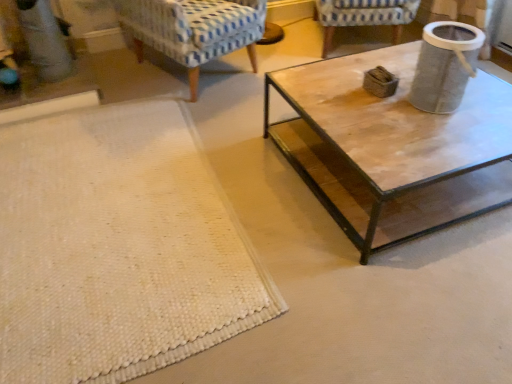
Question: From the image's perspective, is textured gray trash can at upper right under blue patterned fabric chair at upper left, which is the 2th chair from right to left?

Choices:
 (A) no
 (B) yes

Answer: (B)

Question: Can you confirm if textured gray trash can at upper right is positioned to the left of blue patterned fabric chair at upper left, which appears as the first chair when viewed from the left?

Choices:
 (A) yes
 (B) no

Answer: (B)

Question: Can blue patterned fabric chair at upper left, which is the 2th chair from right to left, be found inside textured gray trash can at upper right?

Choices:
 (A) yes
 (B) no

Answer: (B)

Question: From the image's perspective, is textured gray trash can at upper right on top of blue patterned fabric chair at upper left, which is the 2th chair from right to left?

Choices:
 (A) no
 (B) yes

Answer: (A)

Question: Is textured gray trash can at upper right turned away from blue patterned fabric chair at upper left, which is the 2th chair from right to left?

Choices:
 (A) yes
 (B) no

Answer: (B)

Question: Is textured gray trash can at upper right taller than blue patterned fabric chair at upper left, which appears as the first chair when viewed from the left?

Choices:
 (A) no
 (B) yes

Answer: (A)

Question: Can you confirm if blue-patterned fabric chair at upper center, the 2th chair from the left, is wider than blue patterned fabric chair at upper left, which is the 2th chair from right to left?

Choices:
 (A) no
 (B) yes

Answer: (A)

Question: Considering the relative sizes of blue-patterned fabric chair at upper center, the 2th chair from the left, and blue patterned fabric chair at upper left, which is the 2th chair from right to left, in the image provided, is blue-patterned fabric chair at upper center, the 2th chair from the left, shorter than blue patterned fabric chair at upper left, which is the 2th chair from right to left,?

Choices:
 (A) yes
 (B) no

Answer: (A)

Question: Is blue-patterned fabric chair at upper center, which is the first chair from right to left, smaller than blue patterned fabric chair at upper left, which appears as the first chair when viewed from the left?

Choices:
 (A) yes
 (B) no

Answer: (A)

Question: Is blue-patterned fabric chair at upper center, which is the first chair from right to left, further to the viewer compared to blue patterned fabric chair at upper left, which appears as the first chair when viewed from the left?

Choices:
 (A) no
 (B) yes

Answer: (B)

Question: Is blue patterned fabric chair at upper left, which is the 2th chair from right to left, a part of blue-patterned fabric chair at upper center, which is the first chair from right to left?

Choices:
 (A) yes
 (B) no

Answer: (B)

Question: Considering the relative sizes of blue-patterned fabric chair at upper center, which is the first chair from right to left, and blue patterned fabric chair at upper left, which appears as the first chair when viewed from the left, in the image provided, is blue-patterned fabric chair at upper center, which is the first chair from right to left, bigger than blue patterned fabric chair at upper left, which appears as the first chair when viewed from the left,?

Choices:
 (A) no
 (B) yes

Answer: (A)

Question: From the image's perspective, is textured gray trash can at upper right under blue-patterned fabric chair at upper center, which is the first chair from right to left?

Choices:
 (A) no
 (B) yes

Answer: (B)